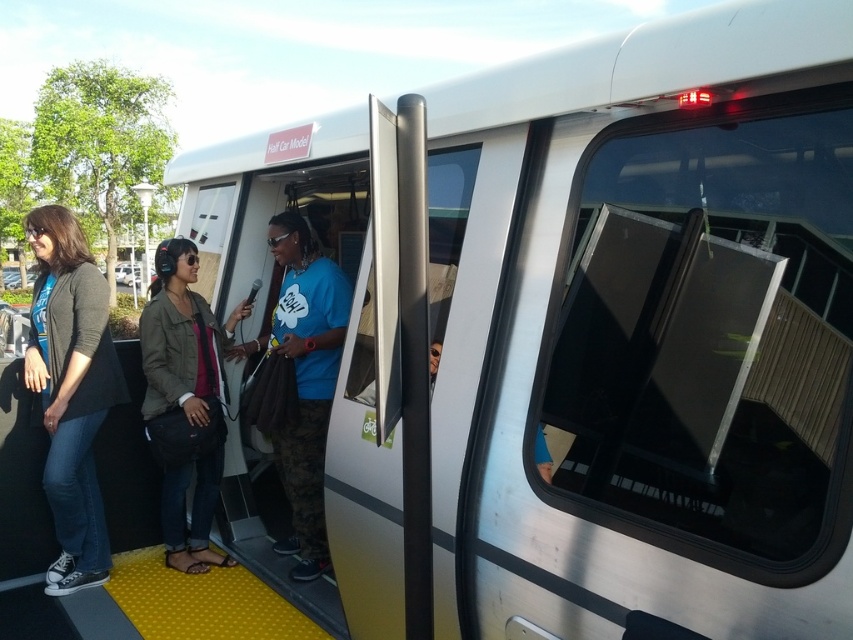
Does point (166, 426) lie behind point (317, 369)?

No, it is in front of (317, 369).

Which is behind, point (199, 396) or point (305, 260)?

The point (305, 260) is more distant.

Where is `denim jacket at center`? Image resolution: width=853 pixels, height=640 pixels. denim jacket at center is located at coordinates (184, 403).

Is matte black jacket at left bigger than blue t-shirt at center?

No, matte black jacket at left is not bigger than blue t-shirt at center.

Between point (44, 221) and point (289, 250), which one is positioned behind?

Positioned behind is point (289, 250).

This screenshot has width=853, height=640. I want to click on matte black jacket at left, so click(x=71, y=390).

Is matte black jacket at left to the right of denim jacket at center from the viewer's perspective?

In fact, matte black jacket at left is to the left of denim jacket at center.

Between matte black jacket at left and denim jacket at center, which one has more height?

matte black jacket at left

Where is `matte black jacket at left`? Image resolution: width=853 pixels, height=640 pixels. matte black jacket at left is located at coordinates (71, 390).

Locate an element on the screen. The height and width of the screenshot is (640, 853). matte black jacket at left is located at coordinates (71, 390).